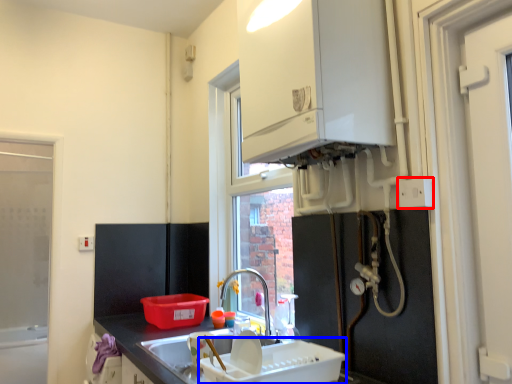
Question: Which object appears closest to the camera in this image, electric outlet (highlighted by a red box) or appliance (highlighted by a blue box)?

Choices:
 (A) electric outlet
 (B) appliance

Answer: (B)